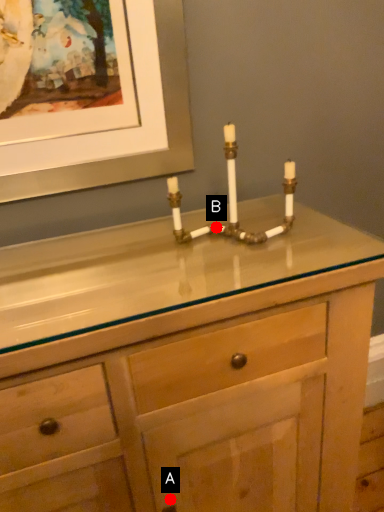
Question: Two points are circled on the image, labeled by A and B beside each circle. Among these points, which one is nearest to the camera?

Choices:
 (A) A is closer
 (B) B is closer

Answer: (A)